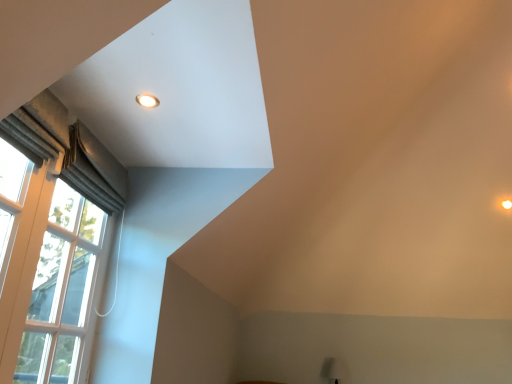
Where is `matte white light fixture at upper left`? This screenshot has width=512, height=384. matte white light fixture at upper left is located at coordinates (147, 101).

The width and height of the screenshot is (512, 384). Describe the element at coordinates (94, 170) in the screenshot. I see `satin grey curtain at left` at that location.

Where is `matte white light fixture at upper left`? This screenshot has width=512, height=384. matte white light fixture at upper left is located at coordinates (147, 101).

At what (x,y) coordinates should I click in order to perform the action: click on window lying above the matte white table lamp at lower right (from the image's perspective). Please return your answer as a coordinate pair (x, y). The width and height of the screenshot is (512, 384). Looking at the image, I should click on (51, 240).

From the image's perspective, between white textured curtain at left and matte white table lamp at lower right, which one is located above?

white textured curtain at left, from the image's perspective.

Does white textured curtain at left have a greater height compared to matte white table lamp at lower right?

Indeed, white textured curtain at left has a greater height compared to matte white table lamp at lower right.

From the image's perspective, would you say satin grey curtain at left is positioned over matte white light fixture at upper left?

Incorrect, from the image's perspective, satin grey curtain at left is lower than matte white light fixture at upper left.

Who is shorter, satin grey curtain at left or matte white light fixture at upper left?

With less height is matte white light fixture at upper left.

Is satin grey curtain at left to the left of matte white light fixture at upper left from the viewer's perspective?

Correct, you'll find satin grey curtain at left to the left of matte white light fixture at upper left.

Is satin grey curtain at left aimed at matte white light fixture at upper left?

Yes.

The image size is (512, 384). Identify the location of lighting above the matte white table lamp at lower right (from the image's perspective). (147, 101).

Is matte white light fixture at upper left taller than matte white table lamp at lower right?

Incorrect, the height of matte white light fixture at upper left is not larger of that of matte white table lamp at lower right.

In the scene shown: Does matte white light fixture at upper left have a larger size compared to matte white table lamp at lower right?

Incorrect, matte white light fixture at upper left is not larger than matte white table lamp at lower right.

Is matte white light fixture at upper left closer to camera compared to matte white table lamp at lower right?

Yes, it is in front of matte white table lamp at lower right.

From a real-world perspective, which is physically above, white textured curtain at left or satin grey curtain at left?

From a 3D spatial view, satin grey curtain at left is above.

Between white textured curtain at left and satin grey curtain at left, which one appears on the right side from the viewer's perspective?

From the viewer's perspective, satin grey curtain at left appears more on the right side.

From the image's perspective, which object appears higher, white textured curtain at left or satin grey curtain at left?

satin grey curtain at left, from the image's perspective.

Based on the photo, between white textured curtain at left and satin grey curtain at left, which one has more height?

white textured curtain at left is taller.

Would you say matte white table lamp at lower right is to the left or to the right of white textured curtain at left in the picture?

matte white table lamp at lower right is to the right of white textured curtain at left.

From a real-world perspective, is matte white table lamp at lower right above or below white textured curtain at left?

matte white table lamp at lower right is below white textured curtain at left.

Is point (329, 369) farther from viewer compared to point (2, 263)?

Yes.

Is matte white table lamp at lower right directly adjacent to white textured curtain at left?

No, matte white table lamp at lower right is not next to white textured curtain at left.

Is satin grey curtain at left facing away from white textured curtain at left?

Yes, satin grey curtain at left is facing away from white textured curtain at left.

Which object is further away from the camera taking this photo, satin grey curtain at left or white textured curtain at left?

Positioned behind is satin grey curtain at left.

Measure the distance between satin grey curtain at left and white textured curtain at left.

satin grey curtain at left and white textured curtain at left are 7.31 inches apart from each other.

From the image's perspective, relative to white textured curtain at left, is satin grey curtain at left above or below?

satin grey curtain at left is above white textured curtain at left.

Which is in front, point (345, 376) or point (153, 97)?

Point (153, 97)

From the image's perspective, is matte white table lamp at lower right located beneath matte white light fixture at upper left?

Yes, from the image's perspective, matte white table lamp at lower right is beneath matte white light fixture at upper left.

In the scene shown: Does matte white table lamp at lower right appear on the right side of matte white light fixture at upper left?

Correct, you'll find matte white table lamp at lower right to the right of matte white light fixture at upper left.

Looking at this image, considering the relative sizes of matte white table lamp at lower right and matte white light fixture at upper left in the image provided, is matte white table lamp at lower right taller than matte white light fixture at upper left?

Indeed, matte white table lamp at lower right has a greater height compared to matte white light fixture at upper left.

Image resolution: width=512 pixels, height=384 pixels. Find the location of `window to the left of matte white table lamp at lower right`. window to the left of matte white table lamp at lower right is located at coordinates (51, 240).

The image size is (512, 384). Identify the location of lighting on the right of satin grey curtain at left. (147, 101).

Looking at the image, which one is located further to matte white table lamp at lower right, white textured curtain at left or satin grey curtain at left?

satin grey curtain at left lies further to matte white table lamp at lower right than the other object.

Estimate the real-world distances between objects in this image. Which object is further from satin grey curtain at left, matte white table lamp at lower right or matte white light fixture at upper left?

Based on the image, matte white table lamp at lower right appears to be further to satin grey curtain at left.

Consider the image. Considering their positions, is satin grey curtain at left positioned closer to matte white light fixture at upper left than white textured curtain at left?

satin grey curtain at left is positioned closer to the anchor matte white light fixture at upper left.

Which object lies nearer to the anchor point white textured curtain at left, matte white light fixture at upper left or matte white table lamp at lower right?

matte white light fixture at upper left is positioned closer to the anchor white textured curtain at left.

Looking at the image, which one is located closer to white textured curtain at left, matte white table lamp at lower right or satin grey curtain at left?

satin grey curtain at left is positioned closer to the anchor white textured curtain at left.

From the image, which object appears to be farther from satin grey curtain at left, white textured curtain at left or matte white light fixture at upper left?

Among the two, matte white light fixture at upper left is located further to satin grey curtain at left.

Based on their spatial positions, is matte white light fixture at upper left or white textured curtain at left further from matte white table lamp at lower right?

matte white light fixture at upper left is positioned further to the anchor matte white table lamp at lower right.

Which object lies nearer to the anchor point satin grey curtain at left, matte white light fixture at upper left or white textured curtain at left?

Based on the image, white textured curtain at left appears to be nearer to satin grey curtain at left.

Identify the location of curtain located between white textured curtain at left and matte white table lamp at lower right in the depth direction. This screenshot has width=512, height=384. [x=94, y=170].

I want to click on curtain between matte white light fixture at upper left and white textured curtain at left from top to bottom, so click(x=94, y=170).

The height and width of the screenshot is (384, 512). I want to click on curtain between matte white light fixture at upper left and matte white table lamp at lower right in the front-back direction, so click(x=94, y=170).

Image resolution: width=512 pixels, height=384 pixels. In order to click on lighting located between white textured curtain at left and matte white table lamp at lower right in the depth direction in this screenshot , I will do `click(147, 101)`.